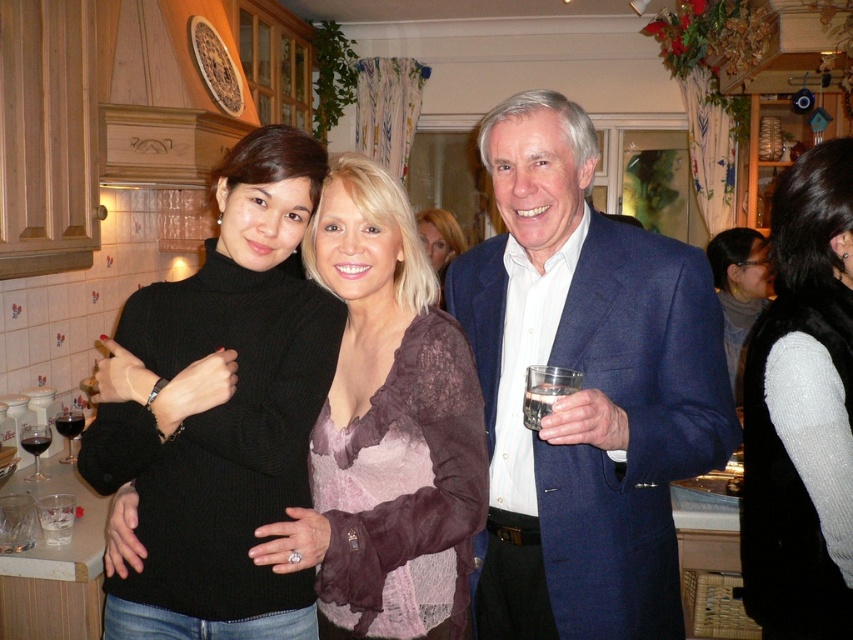
You are organizing a small dinner party and need to decide seating arrangements. You have a narrow table that can only accommodate items up to the width of the transparent glass at lower left. Can the black knit sweater at right be placed on this table without exceeding its width limit?

The black knit sweater at right is wider than the transparent glass at lower left, so placing it on the narrow table designed for the glass width would exceed the table limits. Consider a wider table or fold the sweater.

You are a photographer setting up a shot of the knitted white sweater at right and the clear glass at right. Which object should you adjust your camera focus on first if you want to ensure both are in focus, considering their sizes?

The knitted white sweater at right is wider than the clear glass at right, so you should focus on the knitted white sweater at right first to ensure both are in focus.

You are planning to place a decorative item on a shelf that can only hold items up to the size of the dark red glass at left. Can the blue fabric suit at center fit on the shelf?

The blue fabric suit at center is larger than the dark red glass at left, so it cannot fit on the shelf designed for items up to the size of the dark red glass at left.